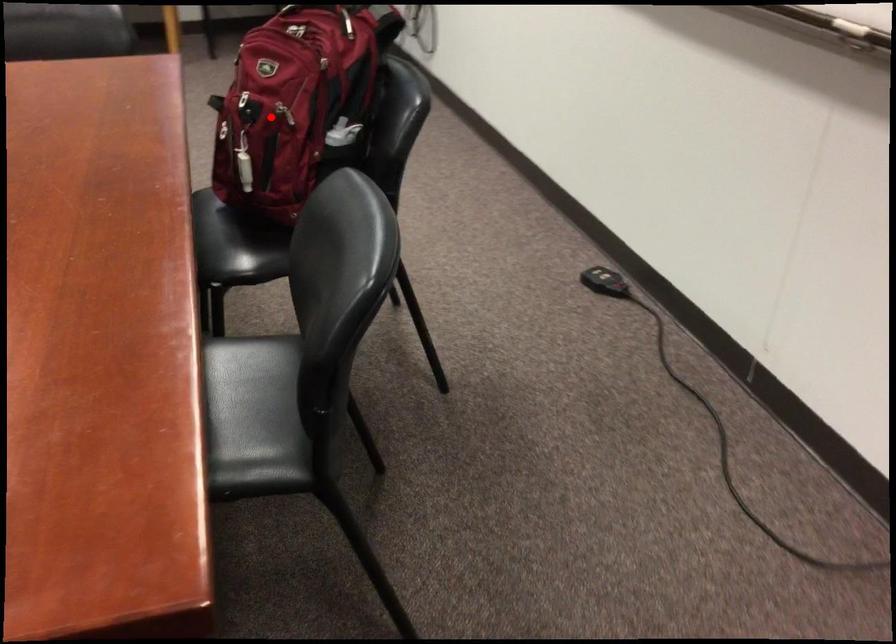
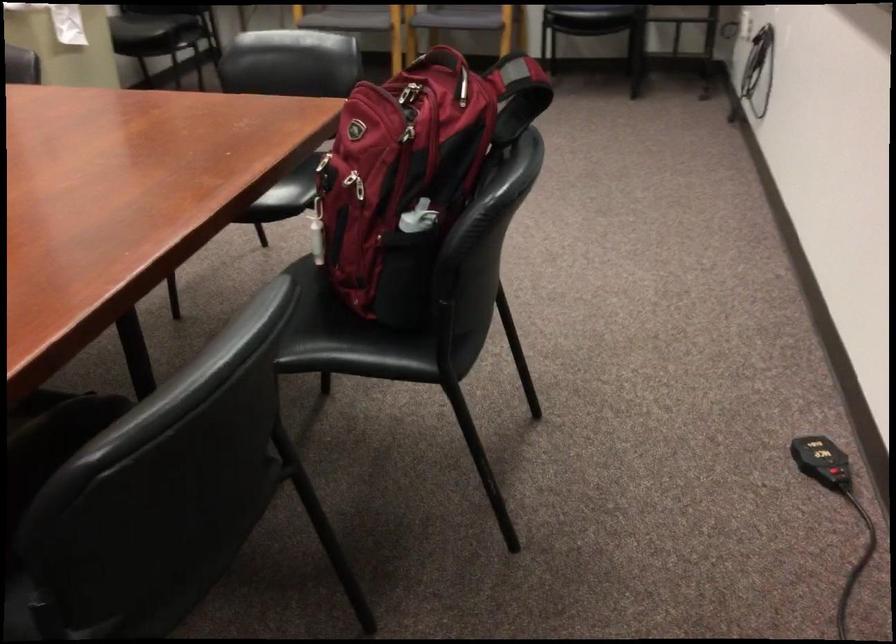
Locate, in the second image, the point that corresponds to the highlighted location in the first image.

(355, 184)